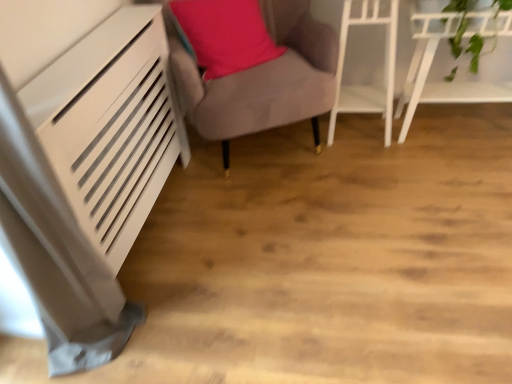
Question: Would you say velvet grey armchair at center, which is counted as the first furniture, starting from the left, is a long distance from white glossy shelf at upper right, which appears as the first furniture when viewed from the right?

Choices:
 (A) yes
 (B) no

Answer: (B)

Question: Is white glossy shelf at upper right, placed as the third furniture when sorted from left to right, a part of velvet grey armchair at center, the third furniture in the right-to-left sequence?

Choices:
 (A) yes
 (B) no

Answer: (B)

Question: From a real-world perspective, is velvet grey armchair at center, which is counted as the first furniture, starting from the left, physically below white glossy shelf at upper right, which appears as the first furniture when viewed from the right?

Choices:
 (A) yes
 (B) no

Answer: (B)

Question: Considering the relative sizes of velvet grey armchair at center, which is counted as the first furniture, starting from the left, and white glossy shelf at upper right, placed as the third furniture when sorted from left to right, in the image provided, is velvet grey armchair at center, which is counted as the first furniture, starting from the left, smaller than white glossy shelf at upper right, placed as the third furniture when sorted from left to right,?

Choices:
 (A) yes
 (B) no

Answer: (B)

Question: Are velvet grey armchair at center, the third furniture in the right-to-left sequence, and white glossy shelf at upper right, which appears as the first furniture when viewed from the right, making contact?

Choices:
 (A) yes
 (B) no

Answer: (B)

Question: Does velvet grey armchair at center, the third furniture in the right-to-left sequence, appear on the left side of white glossy shelf at upper right, placed as the third furniture when sorted from left to right?

Choices:
 (A) yes
 (B) no

Answer: (A)

Question: Considering the relative positions of velvet grey armchair at center, which is counted as the first furniture, starting from the left, and matte pink pillow at center in the image provided, is velvet grey armchair at center, which is counted as the first furniture, starting from the left, in front of matte pink pillow at center?

Choices:
 (A) no
 (B) yes

Answer: (B)

Question: Is velvet grey armchair at center, which is counted as the first furniture, starting from the left, positioned with its back to matte pink pillow at center?

Choices:
 (A) no
 (B) yes

Answer: (B)

Question: Is velvet grey armchair at center, the third furniture in the right-to-left sequence, to the right of matte pink pillow at center from the viewer's perspective?

Choices:
 (A) no
 (B) yes

Answer: (B)

Question: Is velvet grey armchair at center, which is counted as the first furniture, starting from the left, oriented towards matte pink pillow at center?

Choices:
 (A) no
 (B) yes

Answer: (B)

Question: Does velvet grey armchair at center, the third furniture in the right-to-left sequence, have a lesser height compared to matte pink pillow at center?

Choices:
 (A) yes
 (B) no

Answer: (B)

Question: From the image's perspective, is velvet grey armchair at center, the third furniture in the right-to-left sequence, located above matte pink pillow at center?

Choices:
 (A) yes
 (B) no

Answer: (B)

Question: From the image's perspective, is white glossy shelf at upper right, which appears as the first furniture when viewed from the right, located beneath white glossy shelf at upper right, the second furniture positioned from the left?

Choices:
 (A) no
 (B) yes

Answer: (B)